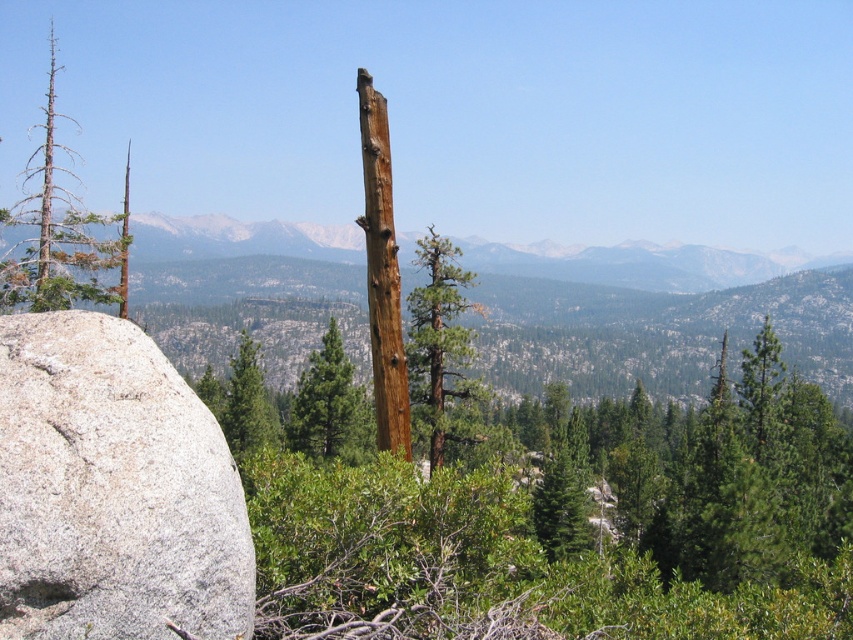
Question: Can you confirm if rocky mountain range at center is positioned above green rough bark tree at center?

Choices:
 (A) no
 (B) yes

Answer: (B)

Question: Can you confirm if brown textured dead tree at left is positioned to the left of green rough bark tree at center?

Choices:
 (A) yes
 (B) no

Answer: (A)

Question: Among these points, which one is nearest to the camera?

Choices:
 (A) (4, 276)
 (B) (457, 307)
 (C) (335, 230)
 (D) (378, 173)

Answer: (D)

Question: Which of the following is the farthest from the observer?

Choices:
 (A) green matte tree at center
 (B) green rough bark tree at center
 (C) brown rough wood at center
 (D) gray rough boulder at left

Answer: (B)

Question: Is rocky mountain range at center closer to the viewer compared to brown textured dead tree at left?

Choices:
 (A) no
 (B) yes

Answer: (A)

Question: Which of the following is the closest to the observer?

Choices:
 (A) brown rough wood at center
 (B) green matte tree at center

Answer: (A)